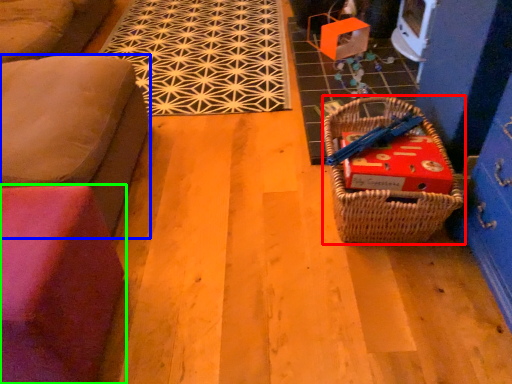
Question: Estimate the real-world distances between objects in this image. Which object is closer to picnic basket (highlighted by a red box), furniture (highlighted by a blue box) or furniture (highlighted by a green box)?

Choices:
 (A) furniture
 (B) furniture

Answer: (B)